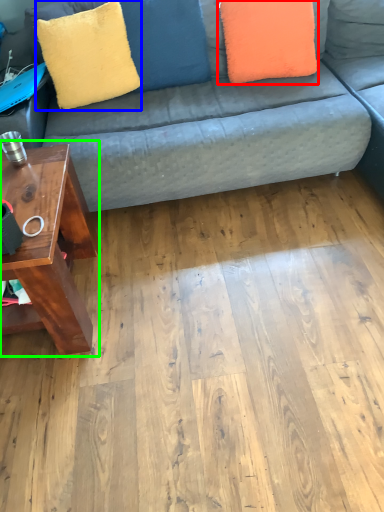
Question: Estimate the real-world distances between objects in this image. Which object is closer to pillow (highlighted by a red box), throw pillow (highlighted by a blue box) or table (highlighted by a green box)?

Choices:
 (A) throw pillow
 (B) table

Answer: (A)